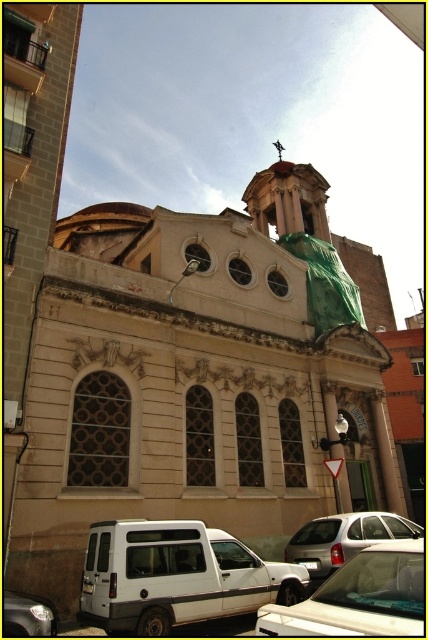
You are a delivery driver approaching the beige stone church at center and the shiny silver van at lower left. Which vehicle is closer to you?

The shiny silver van at lower left is behind the beige stone church at center, so the beige stone church at center is closer to you.

You are standing in front of the building and want to take a photo. You notice two points on the building marked as point 1 and point 2. If point 1 is at coordinate (379, 477) and point 2 is at coordinate (404, 561), which point is closer to your camera lens when taking the photo?

Point 1 at coordinate (379, 477) is closer to the camera lens than point 2 at coordinate (404, 561) because it is further to the camera according to the description.

You are standing in front of a beige stone church at center. If you want to take a photo of the entire structure without any part being cut off, what is the minimum distance you should stand from the church?

The beige stone church at center is 35.01 meters from camera, so you should stand at least 35.01 meters away to capture the entire structure in the photo.